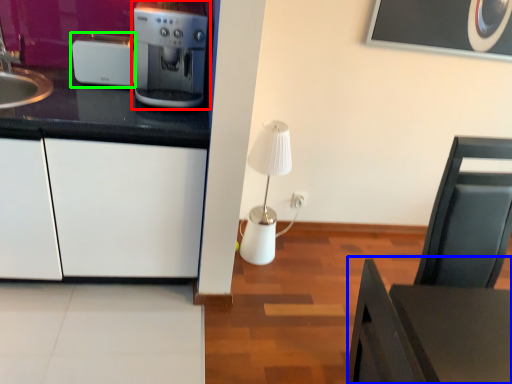
Question: Which is farther away from home appliance (highlighted by a red box)? table (highlighted by a blue box) or kitchen appliance (highlighted by a green box)?

Choices:
 (A) table
 (B) kitchen appliance

Answer: (A)